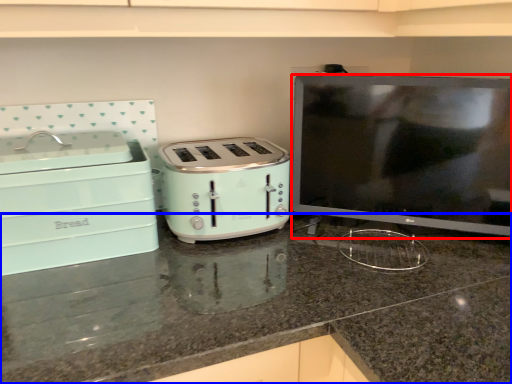
Question: Which of the following is the farthest to the observer, appliance (highlighted by a red box) or countertop (highlighted by a blue box)?

Choices:
 (A) appliance
 (B) countertop

Answer: (A)